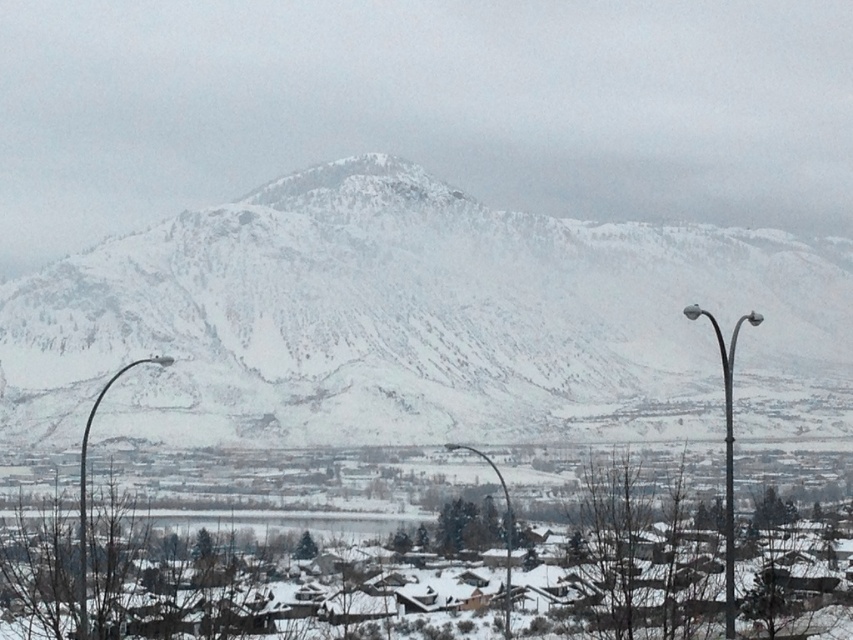
Question: Considering the real-world distances, which object is farthest from the glossy metal streetlight at lower center?

Choices:
 (A) snowy rock formation at center
 (B) white snow-covered houses at lower center

Answer: (A)

Question: Where is white snow-covered houses at lower center located in relation to metallic gray streetlight at right in the image?

Choices:
 (A) below
 (B) above

Answer: (A)

Question: Is snowy rock formation at center positioned at the back of metallic curved pole at left?

Choices:
 (A) yes
 (B) no

Answer: (A)

Question: Which is nearer to the white snow-covered houses at lower center?

Choices:
 (A) glossy metal streetlight at lower center
 (B) metallic gray streetlight at right
 (C) metallic curved pole at left
 (D) snowy rock formation at center

Answer: (A)

Question: Based on their relative distances, which object is farther from the white snow-covered houses at lower center?

Choices:
 (A) metallic curved pole at left
 (B) glossy metal streetlight at lower center
 (C) snowy rock formation at center

Answer: (C)

Question: Does metallic gray streetlight at right appear on the right side of metallic curved pole at left?

Choices:
 (A) no
 (B) yes

Answer: (B)